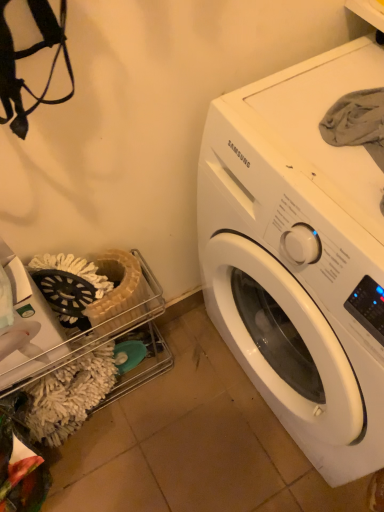
The image size is (384, 512). What do you see at coordinates (300, 256) in the screenshot? I see `white glossy washing machine at upper right` at bounding box center [300, 256].

Measure the distance between point (x=298, y=128) and camera.

The depth of point (x=298, y=128) is 26.50 inches.

You are a GUI agent. You are given a task and a screenshot of the screen. Output one action in this format:
    pyautogui.click(x=<x>, y=<y>)
    Task: Click on the white glossy washing machine at upper right
    The image size is (384, 512).
    Given the screenshot: What is the action you would take?
    pyautogui.click(x=300, y=256)

Identify the location of white glossy washing machine at upper right. This screenshot has width=384, height=512. [x=300, y=256].